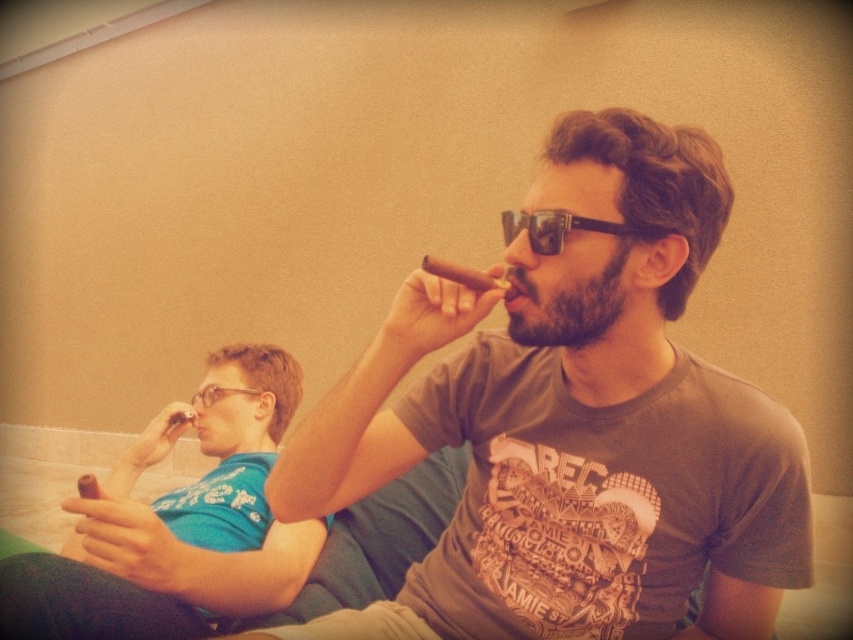
Question: Among these points, which one is nearest to the camera?

Choices:
 (A) (529, 384)
 (B) (560, 337)
 (C) (135, 464)

Answer: (B)

Question: Which object appears farthest from the camera in this image?

Choices:
 (A) black plastic sunglasses at center
 (B) dark brown beard at center
 (C) matte brown cigar at center

Answer: (B)

Question: From the image, what is the correct spatial relationship of matte blue shirt at left in relation to beardsoft hairman smoking cigar at right?

Choices:
 (A) left
 (B) right

Answer: (A)

Question: Which object is farther from the camera taking this photo?

Choices:
 (A) black plastic sunglasses at center
 (B) beardsoft hairman smoking cigar at right

Answer: (B)

Question: Does matte brown cigar at center have a larger size compared to black plastic sunglasses at center?

Choices:
 (A) no
 (B) yes

Answer: (B)

Question: Is matte brown cigar at center to the left of beardsoft hairman smoking cigar at right from the viewer's perspective?

Choices:
 (A) no
 (B) yes

Answer: (A)